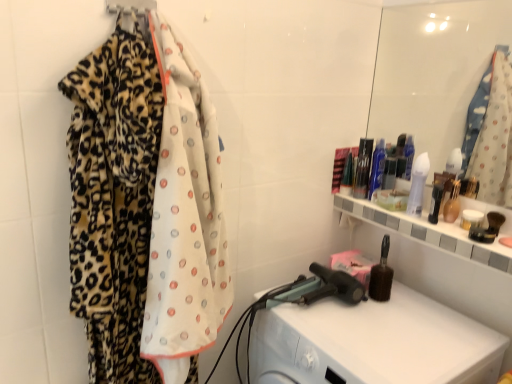
Locate an element on the screen. The height and width of the screenshot is (384, 512). free space in front of brown wooden brush at lower right, which is the sixth toiletry from right to left is located at coordinates (394, 329).